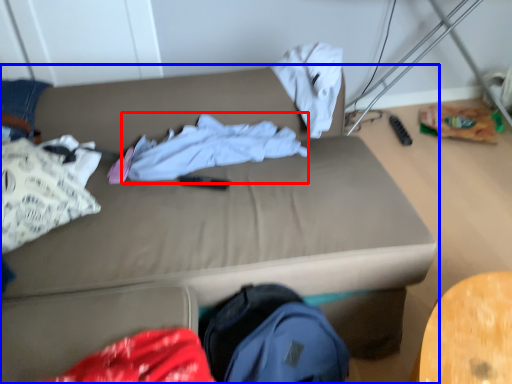
Question: Among these objects, which one is nearest to the camera, clothing (highlighted by a red box) or studio couch (highlighted by a blue box)?

Choices:
 (A) clothing
 (B) studio couch

Answer: (B)